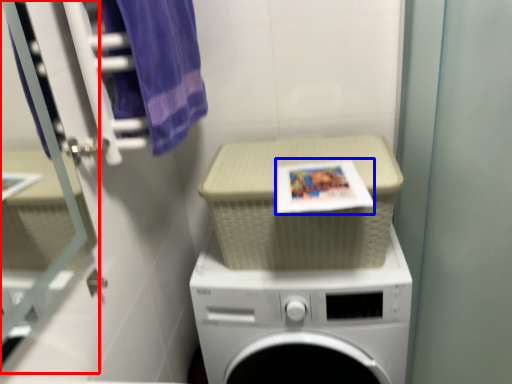
Question: Which point is further to the camera, glass door (highlighted by a red box) or book cover (highlighted by a blue box)?

Choices:
 (A) glass door
 (B) book cover

Answer: (B)